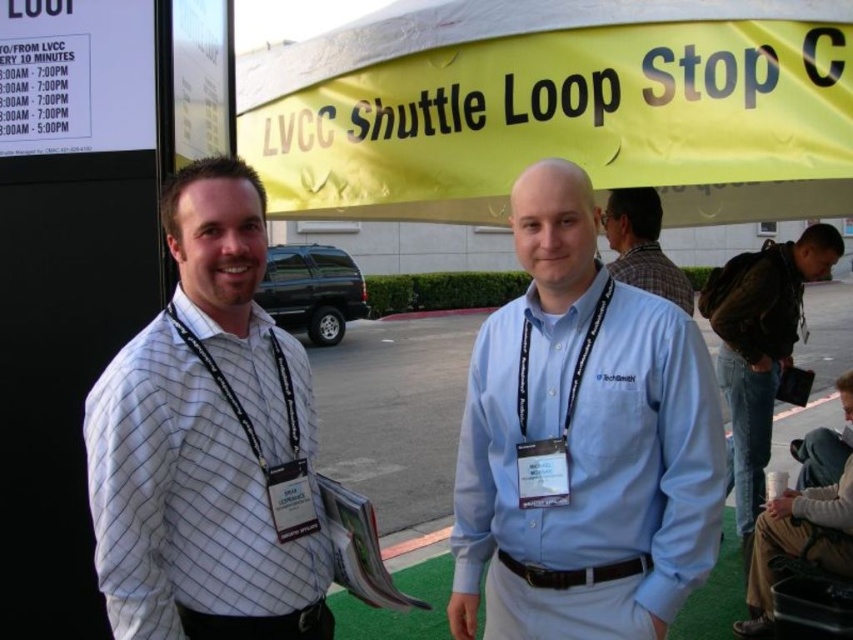
Question: Which of the following is the closest to the observer?

Choices:
 (A) (631, 218)
 (B) (573, 164)
 (C) (820, 435)

Answer: (B)

Question: Which of the following is the closest to the observer?

Choices:
 (A) light blue shirt at lower right
 (B) light brown leather jacket at lower right
 (C) plaid shirt at center

Answer: (C)

Question: Which object is the farthest from the light brown leather jacket at lower right?

Choices:
 (A) light blue shirt at lower right
 (B) yellow fabric canopy at upper center
 (C) black leather jacket at lower right

Answer: (B)

Question: Is yellow fabric canopy at upper center wider than white striped shirt at left?

Choices:
 (A) no
 (B) yes

Answer: (B)

Question: Is plaid shirt at center further to the viewer compared to light blue shirt at lower right?

Choices:
 (A) yes
 (B) no

Answer: (B)

Question: Can you confirm if plaid shirt at center is smaller than light blue shirt at lower right?

Choices:
 (A) yes
 (B) no

Answer: (B)